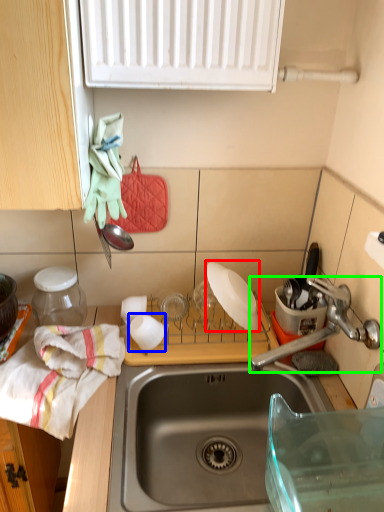
Question: Which object is the farthest from appliance (highlighted by a red box)? Choose among these: tableware (highlighted by a blue box) or tap (highlighted by a green box).

Choices:
 (A) tableware
 (B) tap

Answer: (A)